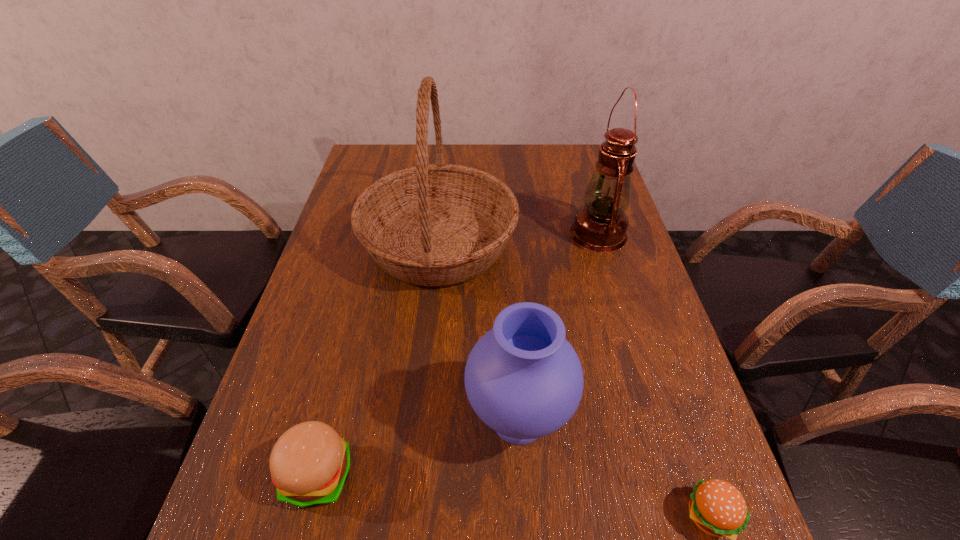
Image resolution: width=960 pixels, height=540 pixels. I want to click on hamburger positioned at the left edge, so click(x=309, y=464).

Locate an element on the screen. object located in the right edge section of the desktop is located at coordinates (600, 226).

Locate an element on the screen. The width and height of the screenshot is (960, 540). vacant point at the far edge is located at coordinates (552, 165).

Identify the location of vacant space at the left edge. tap(333, 276).

At what (x,y) coordinates should I click in order to perform the action: click on free space at the right edge of the desktop. Please return your answer as a coordinate pair (x, y). This screenshot has height=540, width=960. Looking at the image, I should click on (612, 323).

Find the location of a particular element. This screenshot has height=540, width=960. vacant region between the oil lamp and the basket is located at coordinates (518, 239).

The height and width of the screenshot is (540, 960). Find the location of `free spot between the vase and the second shortest object`. free spot between the vase and the second shortest object is located at coordinates (419, 447).

This screenshot has width=960, height=540. What are the coordinates of `empty space that is in between the taller hamburger and the vase` in the screenshot? It's located at (419, 447).

This screenshot has width=960, height=540. Find the location of `free space between the taller hamburger and the third shortest object`. free space between the taller hamburger and the third shortest object is located at coordinates (419, 447).

Find the location of a particular element. free point between the basket and the oil lamp is located at coordinates (518, 239).